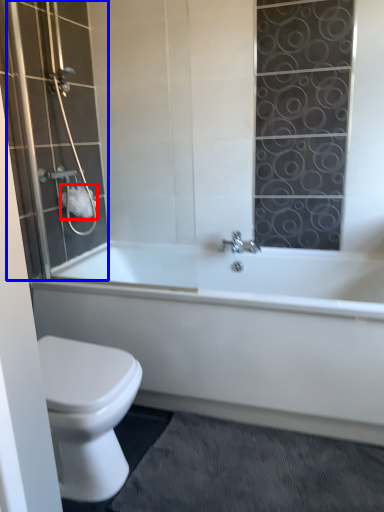
Question: Among these objects, which one is nearest to the camera, toilet paper (highlighted by a red box) or shower door (highlighted by a blue box)?

Choices:
 (A) toilet paper
 (B) shower door

Answer: (B)